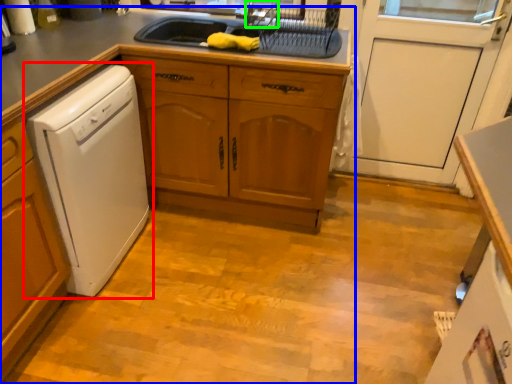
Question: Based on their relative distances, which object is farther from home appliance (highlighted by a red box)? Choose from countertop (highlighted by a blue box) and faucet (highlighted by a green box).

Choices:
 (A) countertop
 (B) faucet

Answer: (B)